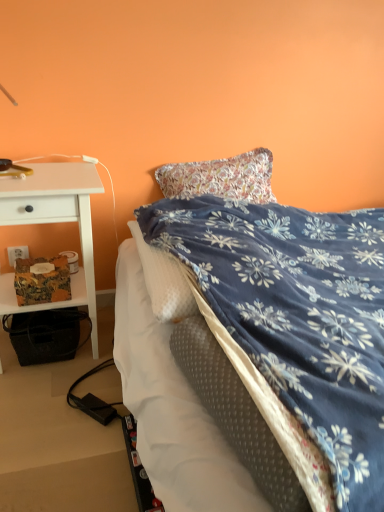
Question: From their relative heights in the image, would you say white wood desk at left is taller or shorter than white plastic power outlet at lower left?

Choices:
 (A) short
 (B) tall

Answer: (B)

Question: Based on their positions, is white wood desk at left located to the left or right of white plastic power outlet at lower left?

Choices:
 (A) left
 (B) right

Answer: (B)

Question: Based on their relative distances, which object is nearer to the blue floral blanket at center?

Choices:
 (A) white wood desk at left
 (B) white plastic power outlet at lower left

Answer: (A)

Question: Considering the real-world distances, which object is farthest from the white plastic power outlet at lower left?

Choices:
 (A) white wood desk at left
 (B) blue floral blanket at center

Answer: (B)